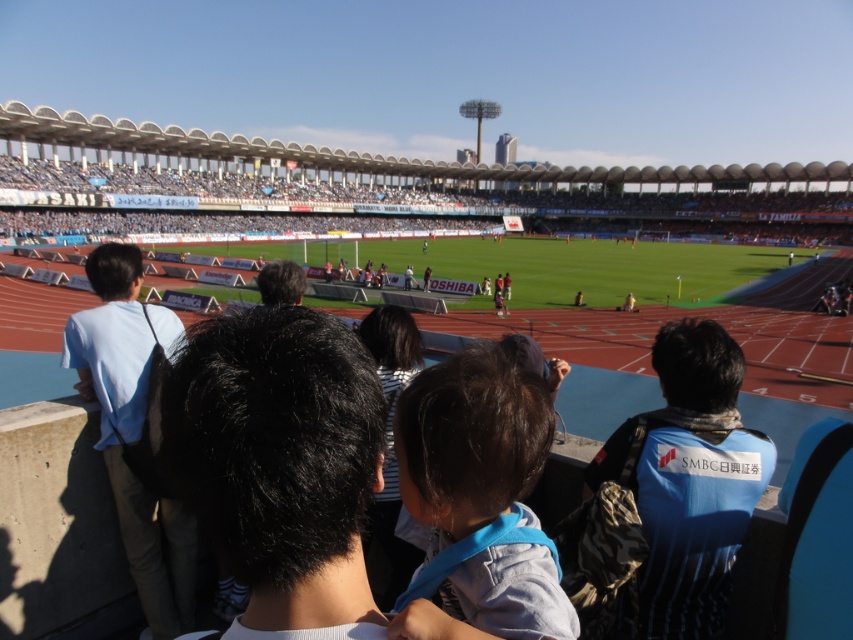
Question: Which point is farther from the camera taking this photo?

Choices:
 (A) (111, 362)
 (B) (547, 602)
 (C) (677, 573)

Answer: (A)

Question: Can you confirm if blue fabric jacket at lower right is wider than light blue shirt at left?

Choices:
 (A) no
 (B) yes

Answer: (A)

Question: Is blue denim shirt at center to the left of blue fabric jacket at lower right from the viewer's perspective?

Choices:
 (A) yes
 (B) no

Answer: (A)

Question: Which of the following is the closest to the observer?

Choices:
 (A) (505, 472)
 (B) (686, 595)
 (C) (97, 349)

Answer: (A)

Question: Does blue denim shirt at center have a larger size compared to light blue shirt at left?

Choices:
 (A) no
 (B) yes

Answer: (A)

Question: Based on their relative distances, which object is nearer to the light blue shirt at left?

Choices:
 (A) blue fabric jacket at lower right
 (B) blue denim shirt at center

Answer: (B)